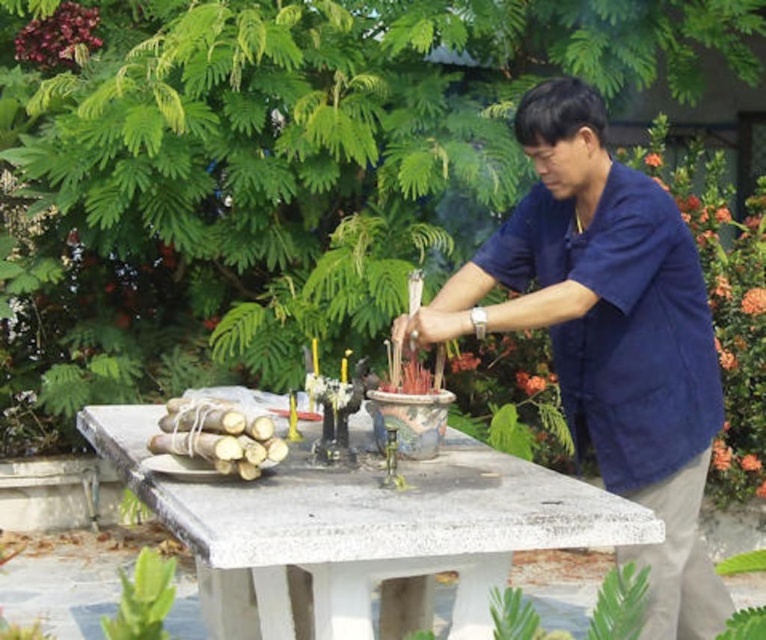
You are a tailor measuring fabrics for a customer. You have a piece of fabric that is exactly the width of the natural bamboo sticks at left. Can the blue cotton shirt at center be made from this fabric without needing to be trimmed?

The blue cotton shirt at center is wider than the natural bamboo sticks at left. Since the fabric is only as wide as the bamboo sticks, the shirt cannot be made without trimming the fabric to a narrower width.